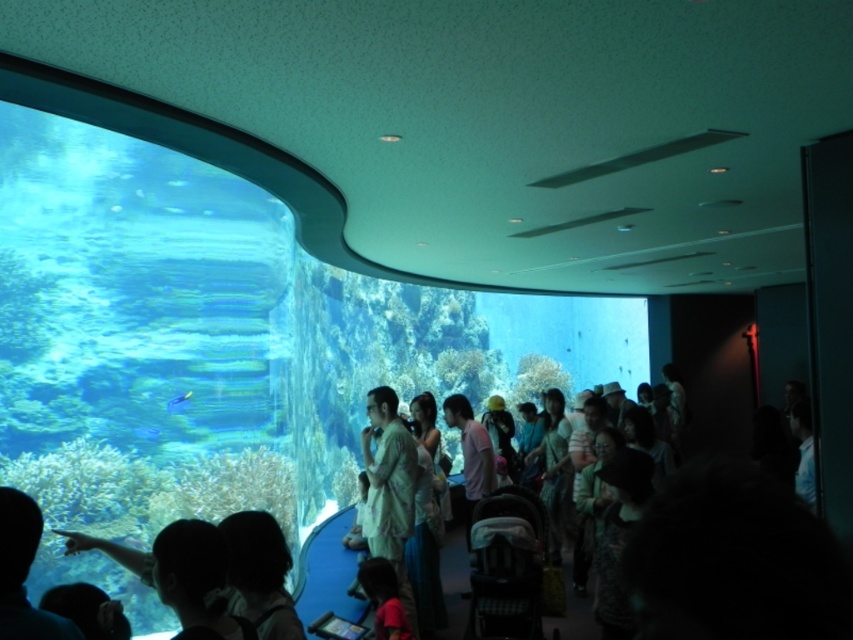
Who is lower down, matte red shirt at lower center or blue glossy fish at lower center?

matte red shirt at lower center is lower down.

Which is behind, point (374, 577) or point (178, 401)?

Positioned behind is point (178, 401).

At what (x,y) coordinates should I click in order to perform the action: click on matte red shirt at lower center. Please return your answer as a coordinate pair (x, y). Looking at the image, I should click on (384, 598).

Locate an element on the screen. Image resolution: width=853 pixels, height=640 pixels. matte red shirt at lower center is located at coordinates (384, 598).

Who is more distant from viewer, (363, 563) or (154, 429)?

The point (154, 429) is behind.

Identify the location of matte red shirt at lower center. (384, 598).

Who is more distant from viewer, (397,621) or (141,432)?

Point (141,432)

Identify the location of matte red shirt at lower center. (384, 598).

Which is above, blue glossy fish at lower center or blue glossy fish at center?

blue glossy fish at lower center

Does blue glossy fish at lower center have a lesser width compared to blue glossy fish at center?

Result: Indeed, blue glossy fish at lower center has a lesser width compared to blue glossy fish at center.

This screenshot has height=640, width=853. I want to click on blue glossy fish at lower center, so click(178, 401).

Where is `blue glossy fish at lower center`? This screenshot has height=640, width=853. blue glossy fish at lower center is located at coordinates (178, 401).